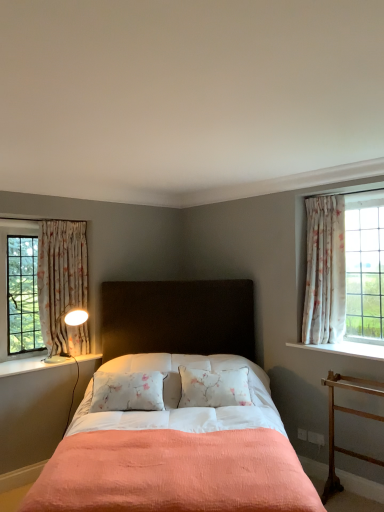
Image resolution: width=384 pixels, height=512 pixels. I want to click on free space above floral fabric curtain at left, positioned as the 2th curtain in right-to-left order (from a real-world perspective), so (x=68, y=219).